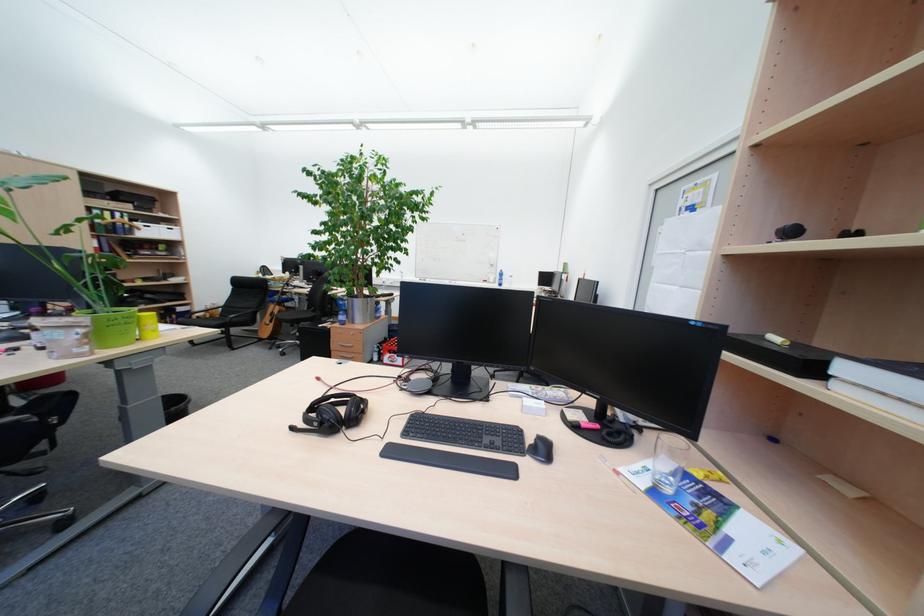
This screenshot has width=924, height=616. What do you see at coordinates (225, 317) in the screenshot?
I see `the chair sitting surface` at bounding box center [225, 317].